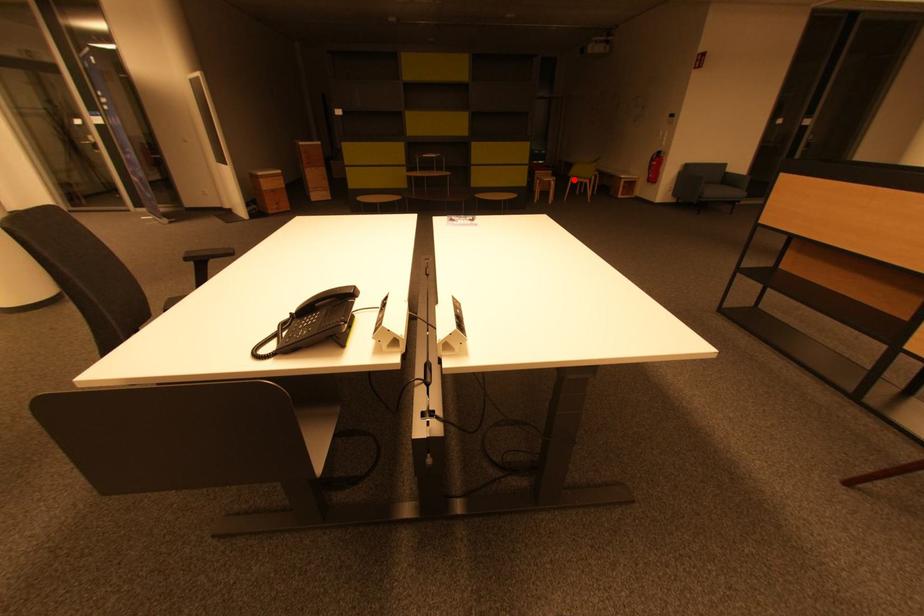
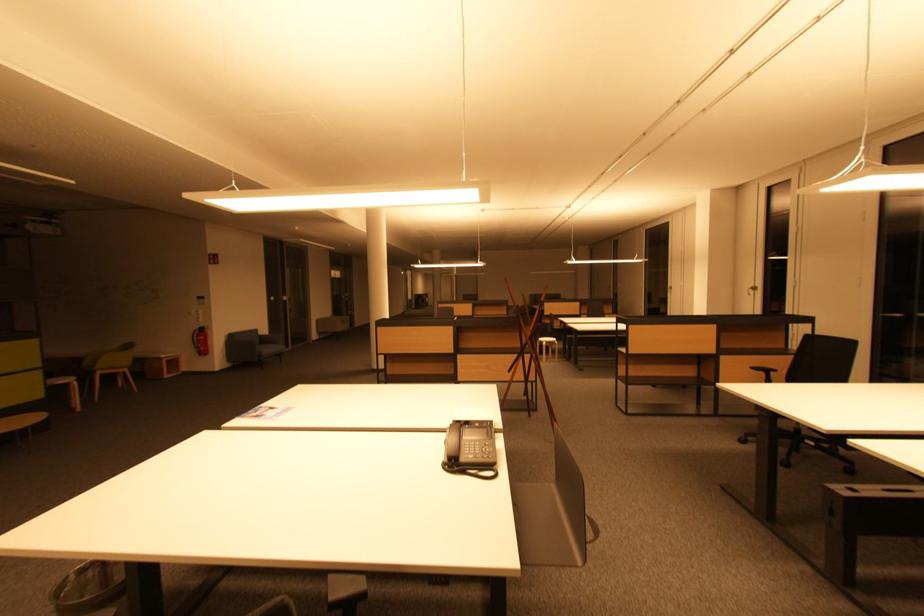
Locate, in the second image, the point that corresponds to the highlighted location in the first image.

(98, 374)